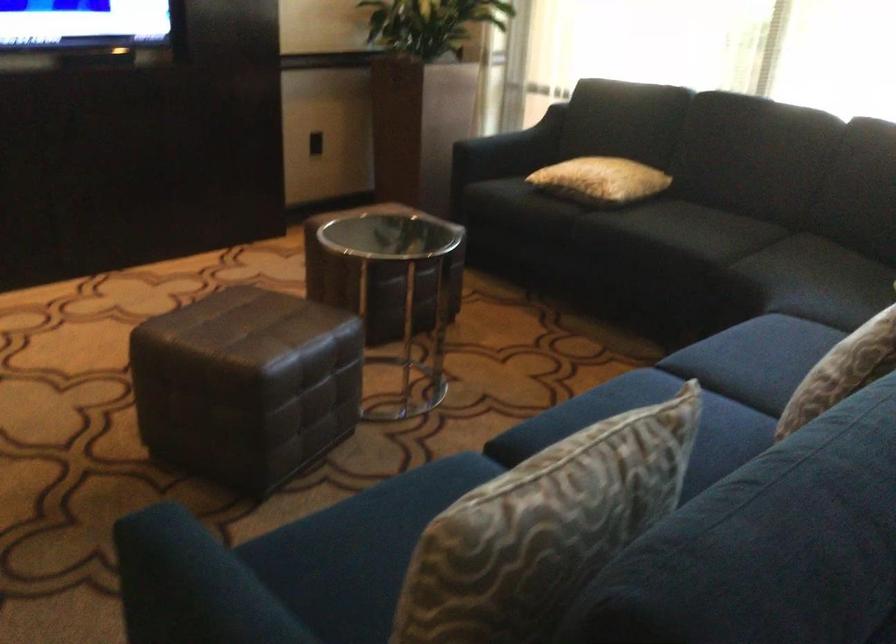
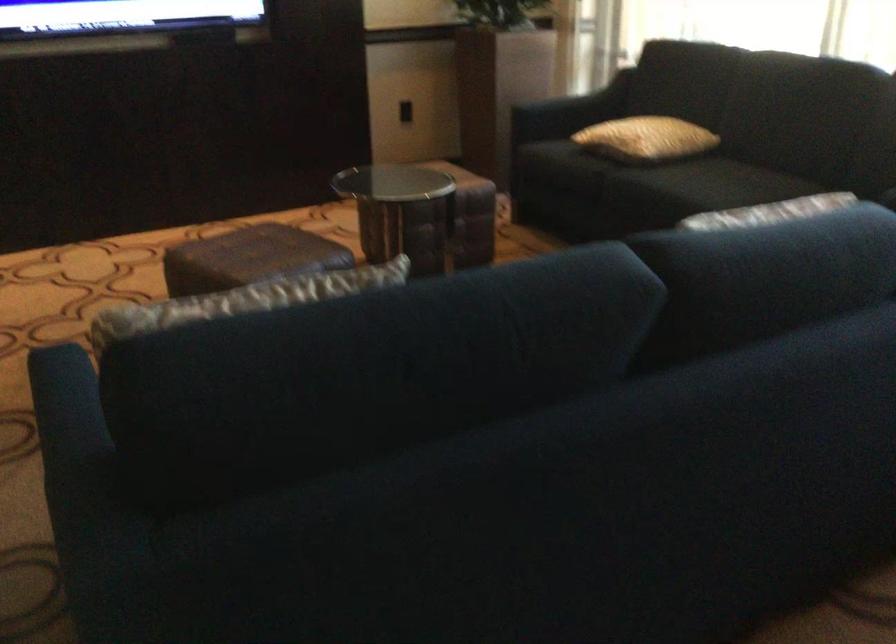
Find the pixel in the second image that matches (521,137) in the first image.

(586, 99)